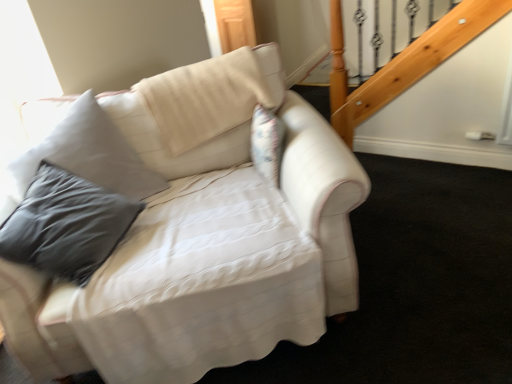
Question: Is beige fabric pillow at upper center to the left of white fabric couch at center from the viewer's perspective?

Choices:
 (A) yes
 (B) no

Answer: (B)

Question: Is beige fabric pillow at upper center positioned behind white fabric couch at center?

Choices:
 (A) no
 (B) yes

Answer: (B)

Question: Is beige fabric pillow at upper center aimed at white fabric couch at center?

Choices:
 (A) no
 (B) yes

Answer: (B)

Question: Is beige fabric pillow at upper center smaller than white fabric couch at center?

Choices:
 (A) yes
 (B) no

Answer: (A)

Question: From a real-world perspective, is beige fabric pillow at upper center on top of white fabric couch at center?

Choices:
 (A) yes
 (B) no

Answer: (A)

Question: Can you confirm if beige fabric pillow at upper center is thinner than white fabric couch at center?

Choices:
 (A) no
 (B) yes

Answer: (B)

Question: Is white fabric couch at center wider than beige fabric pillow at upper center?

Choices:
 (A) yes
 (B) no

Answer: (A)

Question: Is white fabric couch at center outside beige fabric pillow at upper center?

Choices:
 (A) no
 (B) yes

Answer: (B)

Question: Is white fabric couch at center taller than beige fabric pillow at upper center?

Choices:
 (A) no
 (B) yes

Answer: (B)

Question: Is white fabric couch at center not close to beige fabric pillow at upper center?

Choices:
 (A) no
 (B) yes

Answer: (A)

Question: Is white fabric couch at center closer to the viewer compared to beige fabric pillow at upper center?

Choices:
 (A) yes
 (B) no

Answer: (A)

Question: Can you confirm if white fabric couch at center is shorter than beige fabric pillow at upper center?

Choices:
 (A) yes
 (B) no

Answer: (B)

Question: Considering the relative positions of beige fabric pillow at upper center and white fabric couch at center in the image provided, is beige fabric pillow at upper center to the left or to the right of white fabric couch at center?

Choices:
 (A) left
 (B) right

Answer: (B)